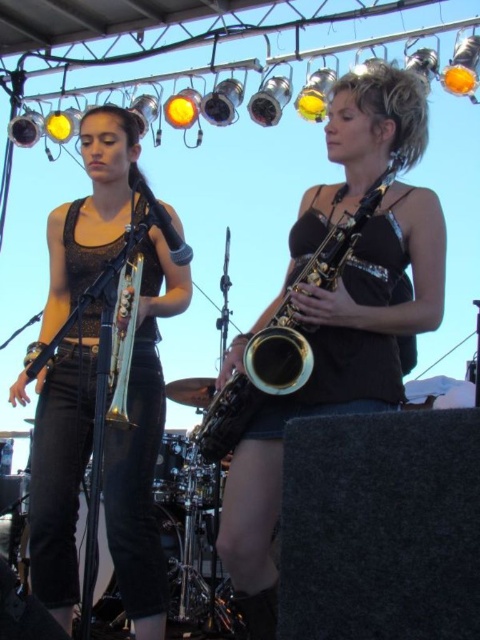
Does shiny gold saxophone at center appear under matte black trombone at left?

No, shiny gold saxophone at center is not below matte black trombone at left.

Does shiny gold saxophone at center appear on the right side of matte black trombone at left?

Indeed, shiny gold saxophone at center is positioned on the right side of matte black trombone at left.

What do you see at coordinates (334, 378) in the screenshot? I see `shiny gold saxophone at center` at bounding box center [334, 378].

The image size is (480, 640). What are the coordinates of `shiny gold saxophone at center` in the screenshot? It's located at (334, 378).

Is matte black trombone at left to the left of gold lacquered saxophone at center from the viewer's perspective?

Correct, you'll find matte black trombone at left to the left of gold lacquered saxophone at center.

Is point (79, 323) closer to camera compared to point (295, 275)?

Yes.

Locate an element on the screen. The image size is (480, 640). matte black trombone at left is located at coordinates (143, 449).

Is shiny gold saxophone at center to the right of gold lacquered saxophone at center from the viewer's perspective?

Yes, shiny gold saxophone at center is to the right of gold lacquered saxophone at center.

Between point (309, 209) and point (273, 323), which one is positioned behind?

The point (309, 209) is more distant.

Does point (301, 211) come closer to viewer compared to point (215, 433)?

No, (301, 211) is behind (215, 433).

Where is `shiny gold saxophone at center`? This screenshot has height=640, width=480. shiny gold saxophone at center is located at coordinates (334, 378).